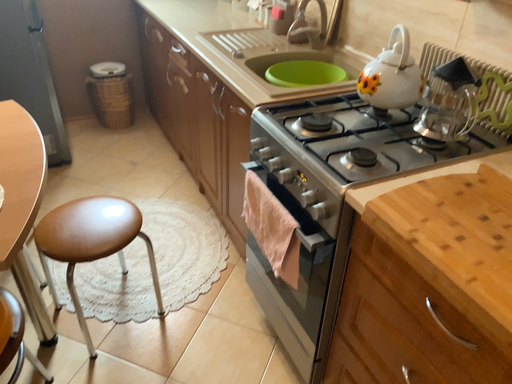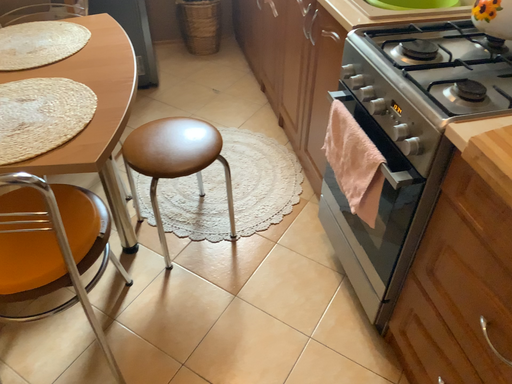
Question: Which way did the camera rotate in the video?

Choices:
 (A) rotated right
 (B) rotated left

Answer: (B)